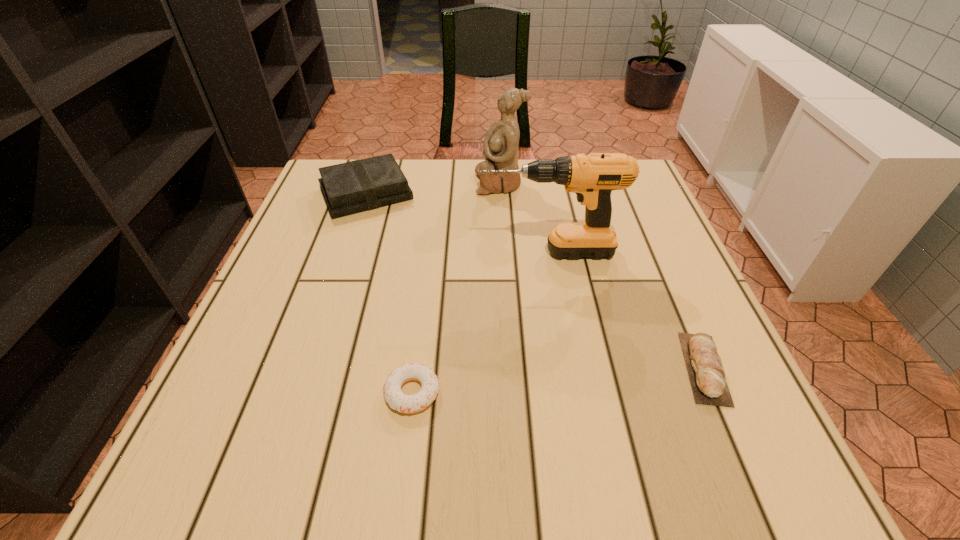
Find the location of a particular element. free space between the drill and the leftmost object is located at coordinates (457, 223).

You are a GUI agent. You are given a task and a screenshot of the screen. Output one action in this format:
    pyautogui.click(x=<x>, y=<y>)
    Task: Click on the free space that is in between the third nearest object and the figurine
    This screenshot has width=960, height=540.
    Given the screenshot: What is the action you would take?
    pyautogui.click(x=523, y=218)

Locate an element on the screen. empty space that is in between the second shortest object and the figurine is located at coordinates (602, 275).

Locate an element on the screen. Image resolution: width=960 pixels, height=540 pixels. blank region between the second object from left to right and the third shortest object is located at coordinates (389, 293).

Locate an element on the screen. The height and width of the screenshot is (540, 960). free space between the rightmost object and the leftmost object is located at coordinates (535, 281).

Find the location of `free space between the figurine and the leftmost object`. free space between the figurine and the leftmost object is located at coordinates click(433, 188).

The image size is (960, 540). Find the location of `vacant area that lies between the book and the figurine`. vacant area that lies between the book and the figurine is located at coordinates (433, 188).

The height and width of the screenshot is (540, 960). Find the location of `unoccupied position between the doughnut and the figurine`. unoccupied position between the doughnut and the figurine is located at coordinates (456, 288).

This screenshot has height=540, width=960. What are the coordinates of `object that is the third closest one to the third nearest object` in the screenshot? It's located at coord(707,376).

Identify which object is located as the fourth nearest to the pita bread. Please provide its 2D coordinates. Your answer should be formatted as a tuple, i.e. [(x, y)], where the tuple contains the x and y coordinates of a point satisfying the conditions above.

[(355, 186)]